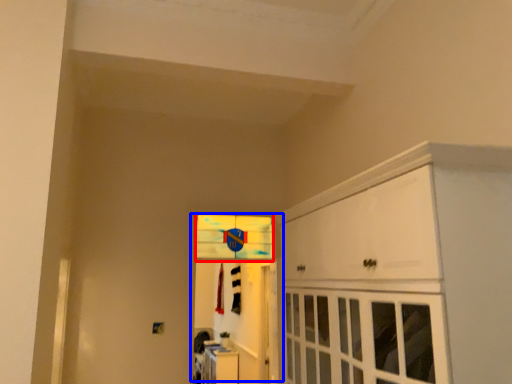
Question: Which of the following is the farthest to the observer, window (highlighted by a red box) or door (highlighted by a blue box)?

Choices:
 (A) window
 (B) door

Answer: (A)